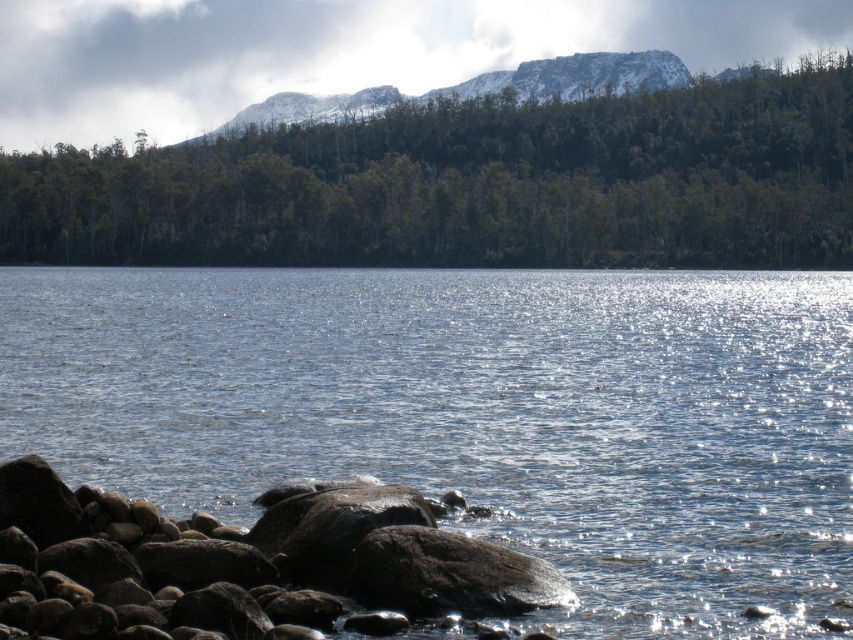
You are standing at the origin point of the image. Which direction should you move to reach the glistening blue water at center?

You should move towards the point at (477, 416) to reach the glistening blue water at center.

Consider the image. You are a hiker standing at the edge of the glistening blue water at center and want to reach the green matte tree at upper center. Which direction should you head towards to get closer to the tree?

The glistening blue water at center is positioned on the left side of the green matte tree at upper center, so you should head to the right to get closer to the tree.

You are standing at the point with coordinates point at (477, 416) in the image. Based on the scene description, what is the most likely surface you are currently standing on?

The point at (477, 416) corresponds to glistening blue water at center, so you are standing on the glistening blue water at center.